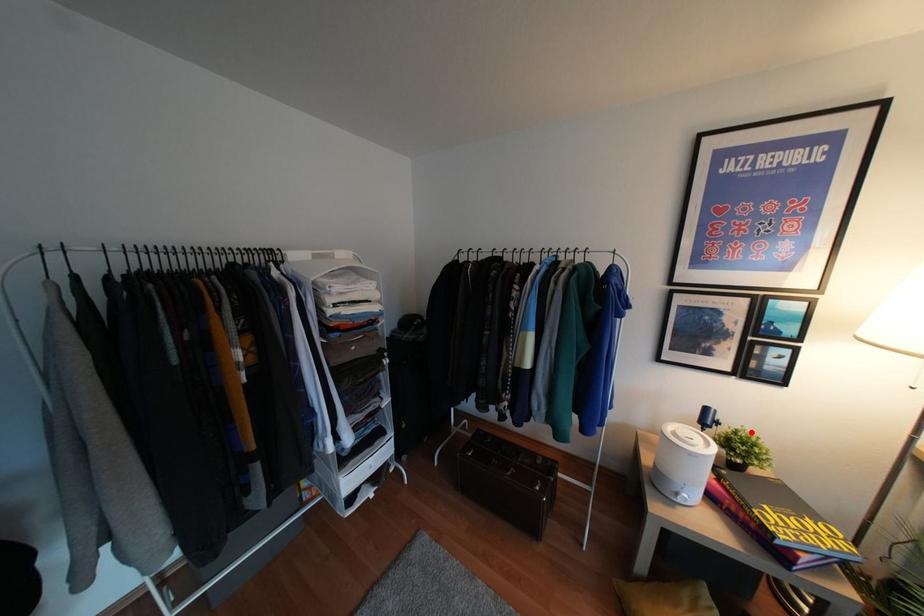
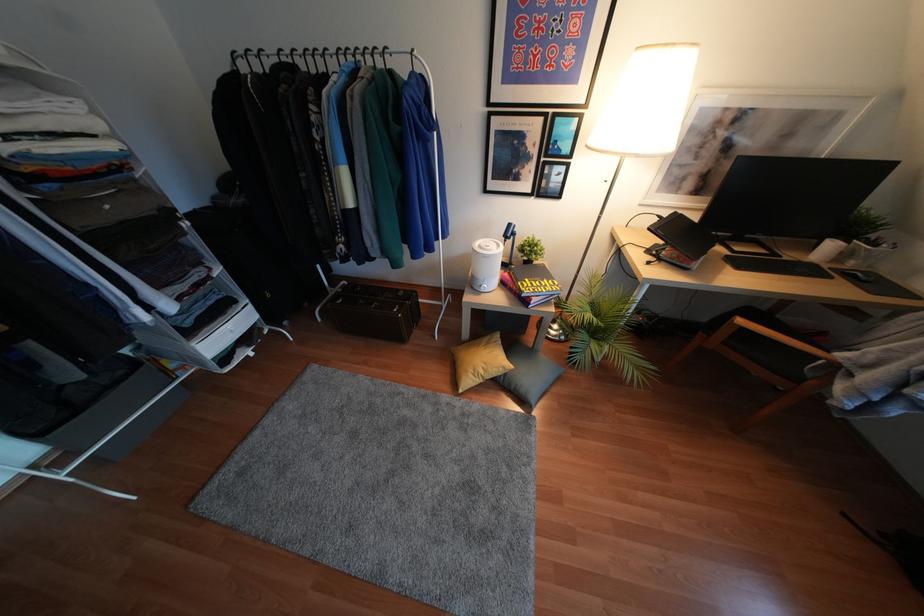
Question: I am providing you with two images of the same scene from different viewpoints. In image1, a red point is highlighted. Considering the same 3D point in image2, which of the following is correct?

Choices:
 (A) It is closer
 (B) It is farther

Answer: (A)